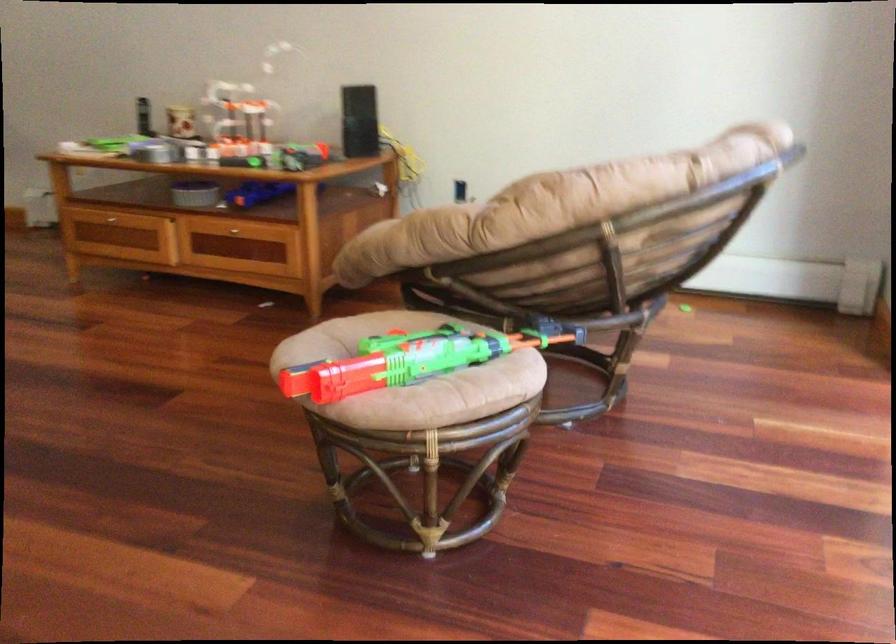
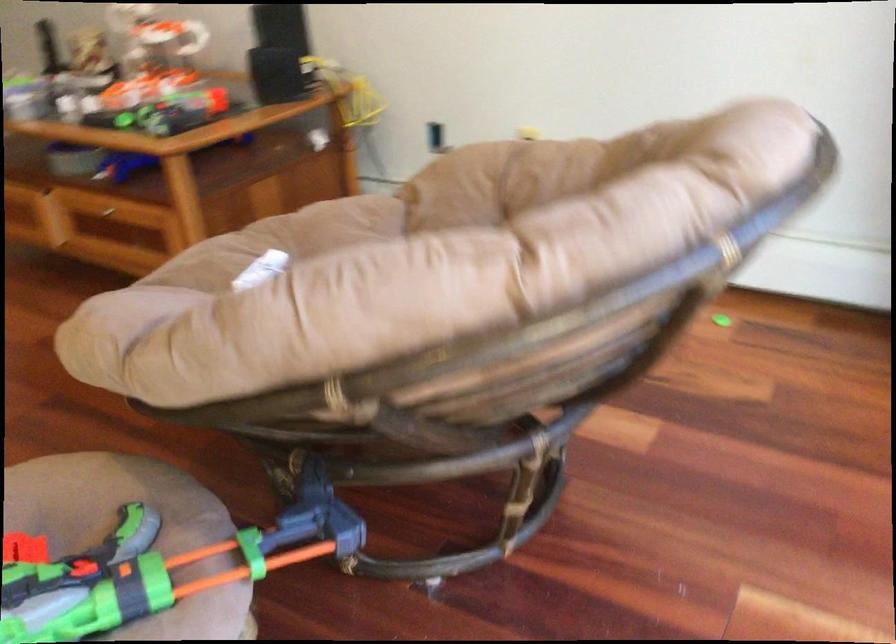
In the second image, find the point that corresponds to (x=510, y=334) in the first image.

(159, 567)